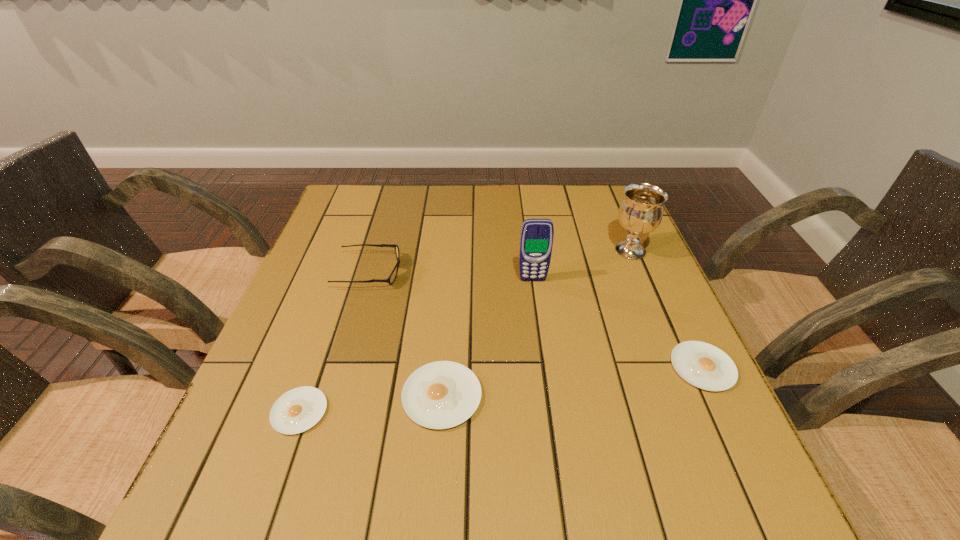
Where is `vacant point located 0.230m on the right of the second egg yolk from right to left`? vacant point located 0.230m on the right of the second egg yolk from right to left is located at coordinates (603, 396).

Image resolution: width=960 pixels, height=540 pixels. In order to click on vacant area located 0.190m on the left of the rightmost egg yolk in this screenshot , I will do [x=577, y=367].

Find the location of a particular element. free region located 0.260m on the front of the chalice is located at coordinates (668, 340).

This screenshot has width=960, height=540. Identify the location of vacant area situated 0.120m on the front-facing side of the third tallest object. (449, 272).

This screenshot has height=540, width=960. I want to click on vacant space situated 0.320m on the front-facing side of the third object from right to left, so (548, 394).

Find the location of a particular element. egg yolk positioned at the left edge is located at coordinates (299, 409).

Locate an element on the screen. This screenshot has width=960, height=540. sunglasses present at the left edge is located at coordinates (393, 275).

Find the location of `egg yolk located at the right edge`. egg yolk located at the right edge is located at coordinates click(703, 365).

Locate an element on the screen. The height and width of the screenshot is (540, 960). chalice situated at the right edge is located at coordinates [x=641, y=211].

Find the location of `object that is at the near left corner`. object that is at the near left corner is located at coordinates (299, 409).